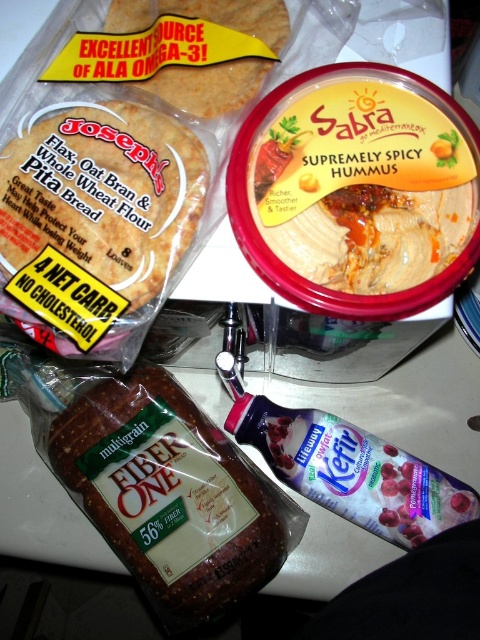
You are a food photographer setting up a shoot. Your camera is positioned to capture the golden brown pita bread at upper left. The pita bread needs to be exactly 18 inches away from the camera to achieve the desired depth of field. Is the current distance sufficient?

The golden brown pita bread at upper left is currently 22.49 inches from the camera, which is farther than the required 18 inches. To achieve the desired depth of field, you should move the pita bread closer to the camera by approximately 4.49 inches.

You are arranging food items on a counter and need to place the brown multigrain fiber one at center and the golden brown pita bread at upper left. If you want to ensure both items are visible, which item should you place closer to the edge of the counter?

The golden brown pita bread at upper left should be placed closer to the edge of the counter because the brown multigrain fiber one at center might be wider and could block its view if placed behind it.